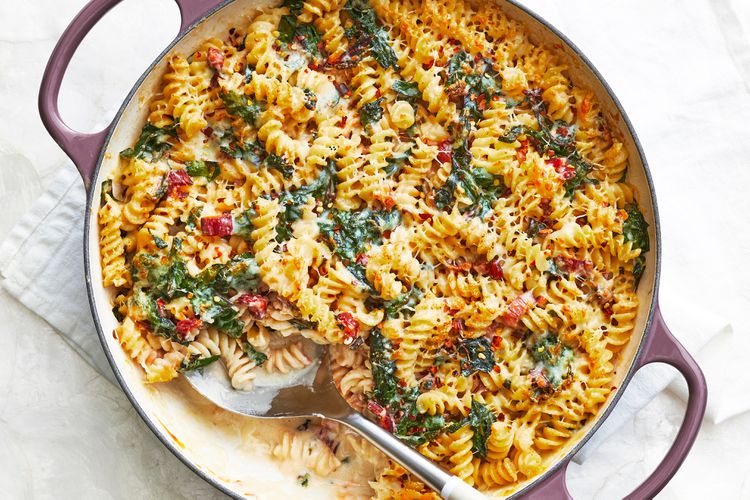
This screenshot has width=750, height=500. I want to click on handle, so click(697, 381), click(58, 51).